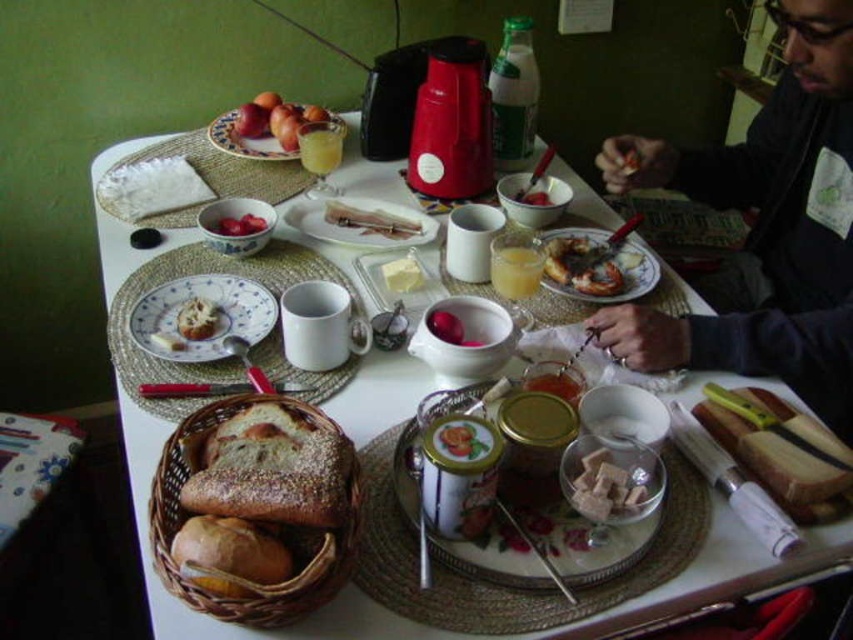
Question: Does porcelain plate at center appear under white crumbly cake at center?

Choices:
 (A) no
 (B) yes

Answer: (B)

Question: Is porcelain plate with floral pattern at center wider than white sugar cubes at center?

Choices:
 (A) no
 (B) yes

Answer: (B)

Question: Estimate the real-world distances between objects in this image. Which object is closer to the translucent glass juice at upper center?

Choices:
 (A) white sugar cubes at center
 (B) golden crusty bread at lower left

Answer: (A)

Question: Which of the following is the closest to the observer?

Choices:
 (A) golden brown crusty bread at lower left
 (B) matte white table at center
 (C) golden crusty bread at lower left

Answer: (C)

Question: Which object appears farthest from the camera in this image?

Choices:
 (A) white creamy butter at center
 (B) white crumbly cake at center
 (C) white sugar cubes at center

Answer: (A)

Question: Is porcelain plate with fruit at upper left closer to camera compared to matte white bowl at upper left?

Choices:
 (A) no
 (B) yes

Answer: (A)